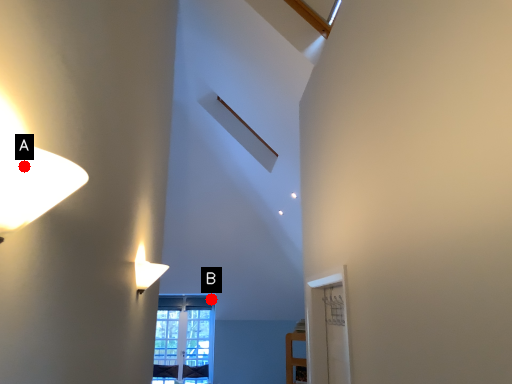
Question: Two points are circled on the image, labeled by A and B beside each circle. Which point is farther from the camera taking this photo?

Choices:
 (A) A is further
 (B) B is further

Answer: (B)